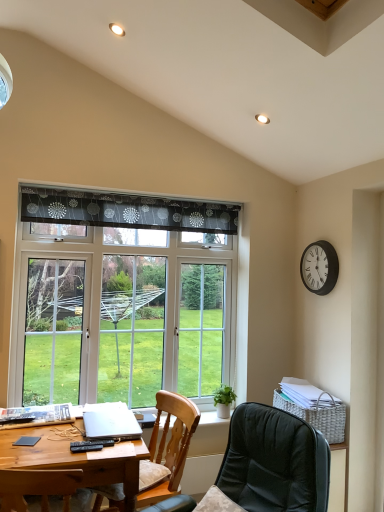
The image size is (384, 512). I want to click on free point above silver metallic laptop at lower left (from a real-world perspective), so click(103, 420).